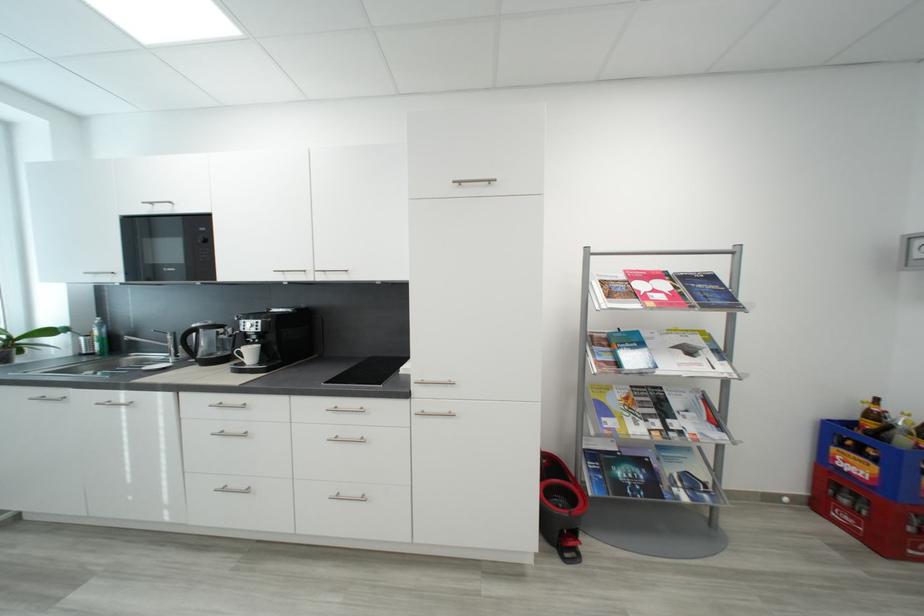
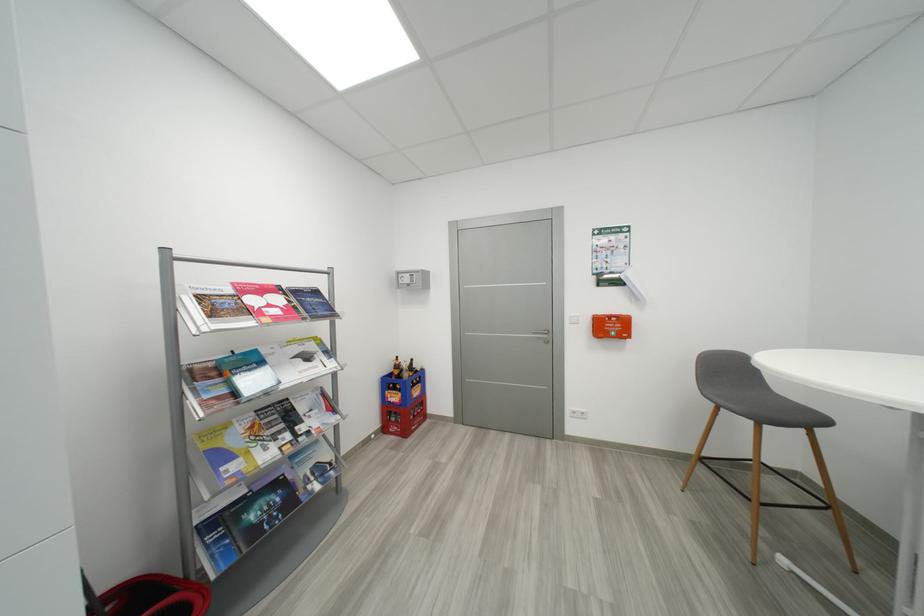
Locate, in the second image, the point that corresponds to (x=697, y=353) in the first image.

(314, 359)